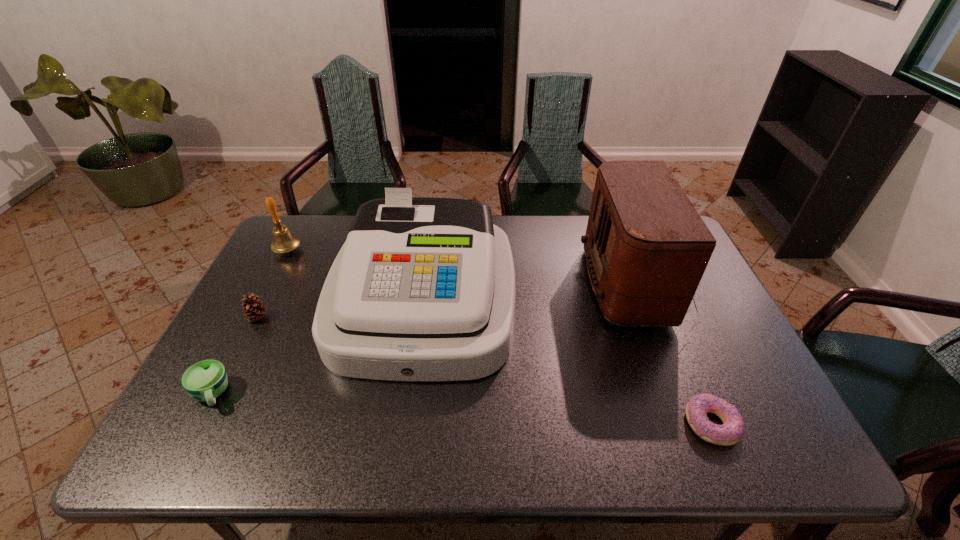
At what (x,y) coordinates should I click in order to perform the action: click on radio receiver. Please return your answer as a coordinate pair (x, y). Image resolution: width=960 pixels, height=540 pixels. Looking at the image, I should click on (647, 248).

At what (x,y) coordinates should I click in order to perform the action: click on cash register. Please return your answer as a coordinate pair (x, y). The width and height of the screenshot is (960, 540). Looking at the image, I should click on point(423,290).

Image resolution: width=960 pixels, height=540 pixels. I want to click on bell, so click(284, 241).

I want to click on the third shortest object, so click(x=254, y=310).

Locate an element on the screen. cup is located at coordinates (205, 380).

At what (x,y) coordinates should I click in order to perform the action: click on the shortest object. Please return your answer as a coordinate pair (x, y). Looking at the image, I should click on (733, 428).

You are a GUI agent. You are given a task and a screenshot of the screen. Output one action in this format:
    pyautogui.click(x=<x>, y=<y>)
    Task: Click on the vacant point located 0.350m on the front panel of the radio receiver
    
    Given the screenshot: What is the action you would take?
    pyautogui.click(x=468, y=284)

The width and height of the screenshot is (960, 540). In order to click on vacant space located 0.190m on the front panel of the radio receiver in this screenshot , I will do `click(521, 284)`.

Locate an element on the screen. This screenshot has height=540, width=960. free space located 0.230m on the front panel of the radio receiver is located at coordinates (508, 284).

At what (x,y) coordinates should I click in order to perform the action: click on free space located 0.090m on the left of the third object from right to left. Please return your answer as a coordinate pair (x, y). The image size is (960, 540). Looking at the image, I should click on (302, 301).